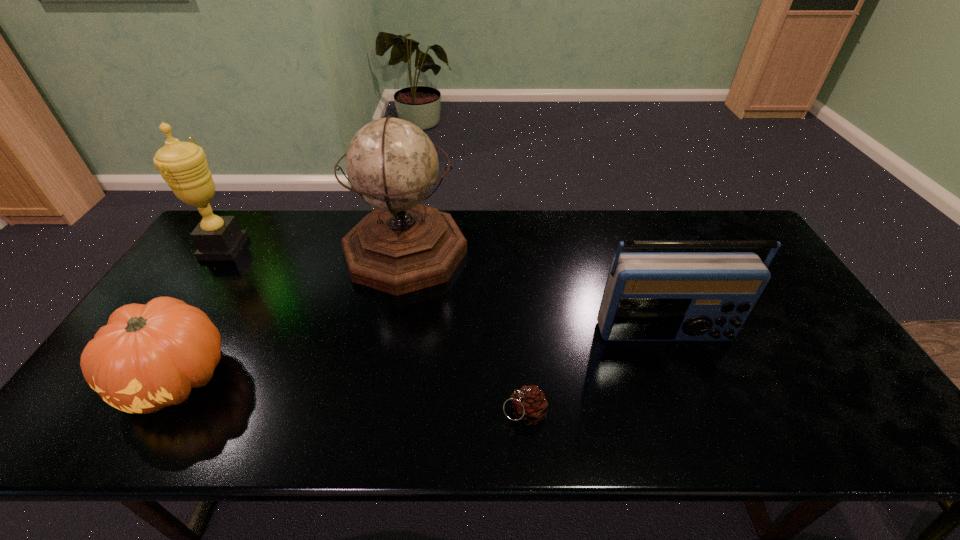
You are a GUI agent. You are given a task and a screenshot of the screen. Output one action in this format:
    pyautogui.click(x=<x>, y=<y>)
    Task: Click on the vacant space located 0.310m with a leaf charm attached to the fourth object from left to right
    
    Given the screenshot: What is the action you would take?
    click(367, 412)

Find the location of a particular element. vacant position located with a leaf charm attached to the fourth object from left to right is located at coordinates (401, 412).

You are a GUI agent. You are given a task and a screenshot of the screen. Output one action in this format:
    pyautogui.click(x=<x>, y=<y>)
    Task: Click on the vacant space situated with a leaf charm attached to the fourth object from left to right
    The image size is (960, 540).
    Given the screenshot: What is the action you would take?
    pyautogui.click(x=463, y=412)

Locate an element on the screen. The width and height of the screenshot is (960, 540). globe located in the far edge section of the desktop is located at coordinates (402, 246).

Image resolution: width=960 pixels, height=540 pixels. Identify the location of trophy cup present at the far edge. tap(183, 165).

I want to click on pumpkin that is at the near edge, so click(147, 357).

This screenshot has width=960, height=540. Identify the location of pinecone that is at the near edge. (529, 405).

The height and width of the screenshot is (540, 960). Identify the location of trophy cup situated at the left edge. (183, 165).

The height and width of the screenshot is (540, 960). In order to click on pumpkin that is at the left edge in this screenshot , I will do `click(147, 357)`.

You are a GUI agent. You are given a task and a screenshot of the screen. Output one action in this format:
    pyautogui.click(x=<x>, y=<y>)
    Task: Click on the object located at the far left corner
    
    Given the screenshot: What is the action you would take?
    click(x=183, y=165)